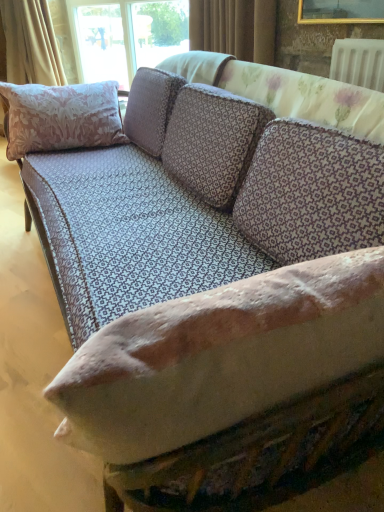
Question: Is pink floral fabric pillow at left not within beige fabric curtain at upper left, the second curtain in the front-to-back sequence?

Choices:
 (A) yes
 (B) no

Answer: (A)

Question: Is pink floral fabric pillow at left facing away from beige fabric curtain at upper left, the first curtain in the back-to-front sequence?

Choices:
 (A) no
 (B) yes

Answer: (B)

Question: From a real-world perspective, is pink floral fabric pillow at left below beige fabric curtain at upper left, the second curtain in the front-to-back sequence?

Choices:
 (A) no
 (B) yes

Answer: (B)

Question: From the image's perspective, is pink floral fabric pillow at left located above beige fabric curtain at upper left, the second curtain in the front-to-back sequence?

Choices:
 (A) yes
 (B) no

Answer: (B)

Question: Considering the relative sizes of pink floral fabric pillow at left and beige fabric curtain at upper left, positioned as the first curtain in left-to-right order, in the image provided, is pink floral fabric pillow at left smaller than beige fabric curtain at upper left, positioned as the first curtain in left-to-right order,?

Choices:
 (A) yes
 (B) no

Answer: (A)

Question: In terms of height, does beige fabric curtain at upper left, acting as the second curtain starting from the right, look taller or shorter compared to brown textured curtain at upper center, which is counted as the 2th curtain, starting from the left?

Choices:
 (A) tall
 (B) short

Answer: (A)

Question: From a real-world perspective, is beige fabric curtain at upper left, the first curtain in the back-to-front sequence, above or below brown textured curtain at upper center, which is counted as the 2th curtain, starting from the left?

Choices:
 (A) above
 (B) below

Answer: (B)

Question: From the image's perspective, is beige fabric curtain at upper left, acting as the second curtain starting from the right, above or below brown textured curtain at upper center, the second curtain in the back-to-front sequence?

Choices:
 (A) above
 (B) below

Answer: (A)

Question: Would you say beige fabric curtain at upper left, the second curtain in the front-to-back sequence, is inside or outside brown textured curtain at upper center, which is the first curtain from front to back?

Choices:
 (A) inside
 (B) outside

Answer: (B)

Question: From a real-world perspective, is brown textured curtain at upper center, which is the first curtain from front to back, physically located above or below pink floral fabric pillow at left?

Choices:
 (A) above
 (B) below

Answer: (A)

Question: In terms of height, does brown textured curtain at upper center, the second curtain in the back-to-front sequence, look taller or shorter compared to pink floral fabric pillow at left?

Choices:
 (A) tall
 (B) short

Answer: (B)

Question: From the image's perspective, is brown textured curtain at upper center, which is counted as the 2th curtain, starting from the left, positioned above or below pink floral fabric pillow at left?

Choices:
 (A) below
 (B) above

Answer: (B)

Question: Visually, is brown textured curtain at upper center, which is counted as the 1th curtain, starting from the right, positioned to the left or to the right of pink floral fabric pillow at left?

Choices:
 (A) left
 (B) right

Answer: (B)

Question: From a real-world perspective, relative to pink floral fabric pillow at left, is beige fabric curtain at upper left, the second curtain in the front-to-back sequence, vertically above or below?

Choices:
 (A) below
 (B) above

Answer: (B)

Question: From the image's perspective, relative to pink floral fabric pillow at left, is beige fabric curtain at upper left, the first curtain in the back-to-front sequence, above or below?

Choices:
 (A) below
 (B) above

Answer: (B)